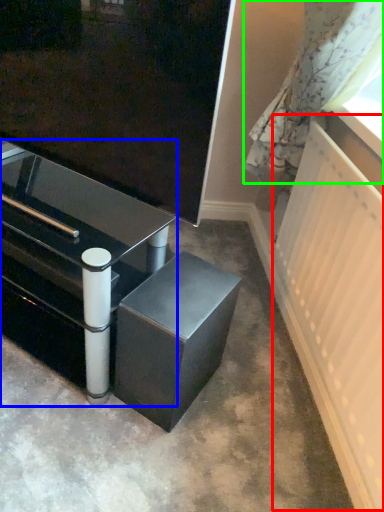
Question: Based on their relative distances, which object is farther from radiator (highlighted by a red box)? Choose from table (highlighted by a blue box) and curtain (highlighted by a green box).

Choices:
 (A) table
 (B) curtain

Answer: (A)